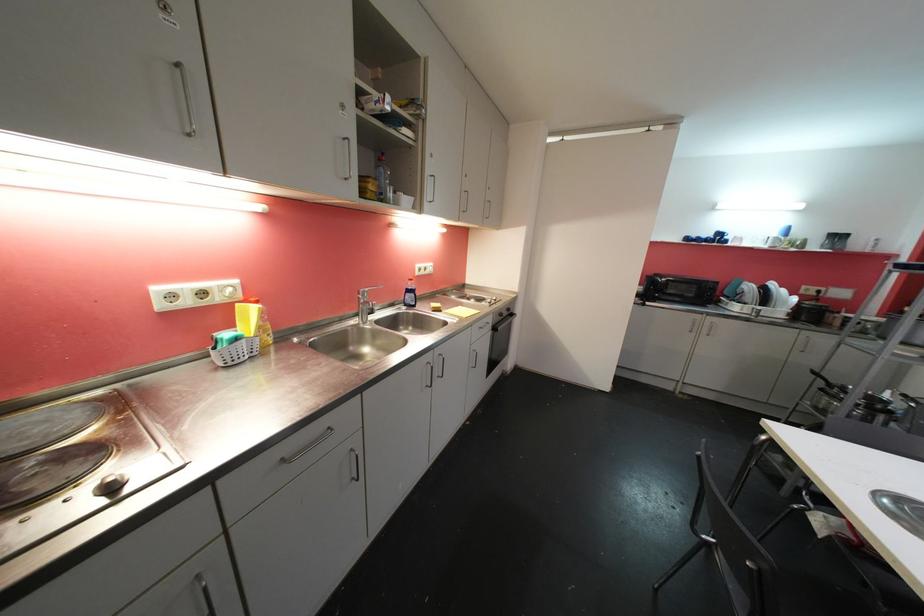
The width and height of the screenshot is (924, 616). Find the location of `stovetop control knob`. stovetop control knob is located at coordinates (110, 484).